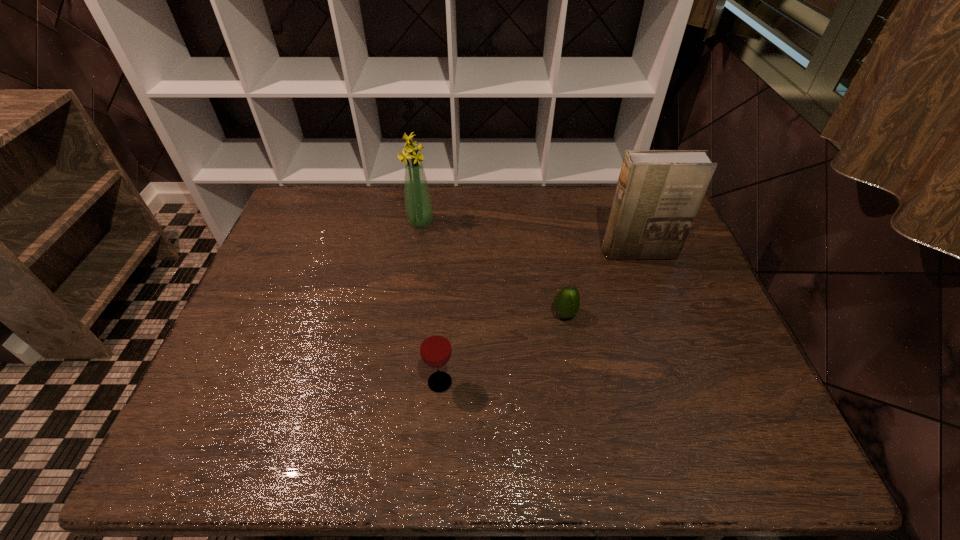
In order to click on free spot that satisfies the following two spatial constraints: 1. on the back side of the third tallest object; 2. on the front-facing side of the farthest object in this screenshot , I will do `click(451, 221)`.

Identify the location of free space that satisfies the following two spatial constraints: 1. on the front-facing side of the shortest object; 2. on the right side of the bouquet. The height and width of the screenshot is (540, 960). (407, 314).

Locate an element on the screen. The image size is (960, 540). free space that satisfies the following two spatial constraints: 1. on the back side of the avocado; 2. on the front-facing side of the farthest object is located at coordinates (548, 221).

Locate an element on the screen. This screenshot has width=960, height=540. vacant space that satisfies the following two spatial constraints: 1. on the front-facing side of the bouquet; 2. on the back side of the third farthest object is located at coordinates (407, 314).

Identify the location of free spot that satisfies the following two spatial constraints: 1. on the front-facing side of the shortest object; 2. on the left side of the leftmost object. This screenshot has height=540, width=960. (407, 314).